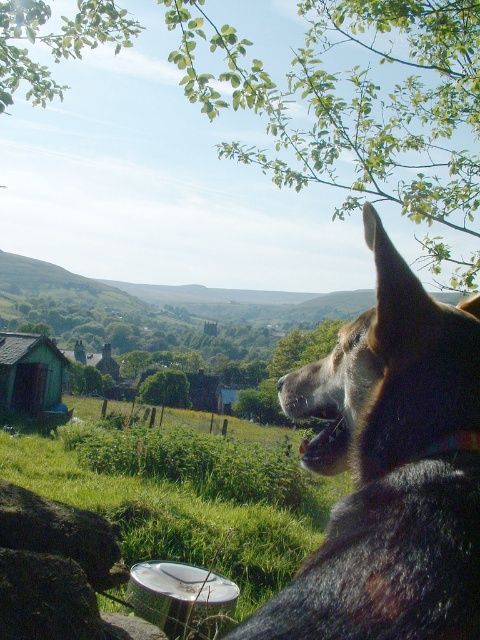
Question: Which point is farther from the camera taking this photo?

Choices:
 (A) (145, 380)
 (B) (11, 483)
 (C) (300, 388)

Answer: (A)

Question: Which of the following is the closest to the observer?

Choices:
 (A) green wooden hut at lower left
 (B) brushed metal bucket at lower center
 (C) black fur dog at right

Answer: (C)

Question: Is black fur dog at right smaller than smooth gray rock at lower left?

Choices:
 (A) no
 (B) yes

Answer: (B)

Question: Is green leafy tree at upper center wider than black fur dog at right?

Choices:
 (A) yes
 (B) no

Answer: (A)

Question: Based on their relative distances, which object is farther from the green wooden hut at lower left?

Choices:
 (A) brushed metal bucket at lower center
 (B) green leafy tree at center
 (C) green leafy tree at upper center

Answer: (C)

Question: Is black fur dog at right positioned behind green leafy tree at center?

Choices:
 (A) yes
 (B) no

Answer: (B)